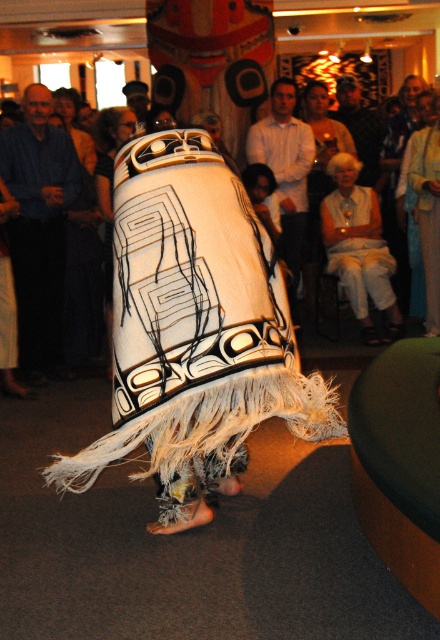
Between blue cotton shirt at left and smooth brown leather jacket at upper center, which one is positioned higher?

smooth brown leather jacket at upper center is higher up.

Find the location of `blue cotton shirt at left`. blue cotton shirt at left is located at coordinates (39, 227).

Is white woven fabric at center thinner than smooth brown leather jacket at upper center?

In fact, white woven fabric at center might be wider than smooth brown leather jacket at upper center.

Is white woven fabric at center behind smooth brown leather jacket at upper center?

No, white woven fabric at center is closer to the viewer.

Is point (290, 221) more distant than point (373, 172)?

That is False.

This screenshot has height=640, width=440. In order to click on white woven fabric at center in this screenshot , I will do `click(286, 170)`.

Who is lower down, blue cotton shirt at left or white woven fabric at center?

Positioned lower is blue cotton shirt at left.

Who is higher up, blue cotton shirt at left or white woven fabric at center?

white woven fabric at center is above.

Is point (29, 339) behind point (253, 161)?

No.

Where is `blue cotton shirt at left`? This screenshot has width=440, height=640. blue cotton shirt at left is located at coordinates (39, 227).